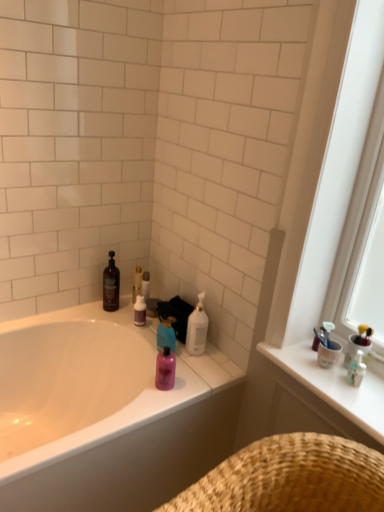
Find the location of `vacant area in front of blue glossy bottle at center, arranged as the 2th cleaning product when viewed from the right`. vacant area in front of blue glossy bottle at center, arranged as the 2th cleaning product when viewed from the right is located at coordinates (183, 379).